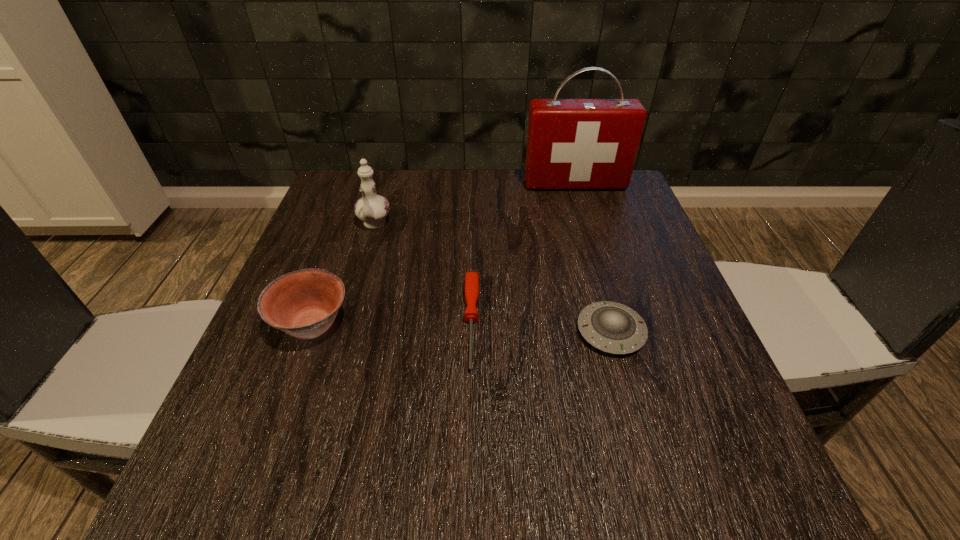
This screenshot has height=540, width=960. Identify the location of the tallest object. (572, 144).

Find the location of a particular element. the first-aid kit is located at coordinates (572, 144).

The width and height of the screenshot is (960, 540). What are the coordinates of `the fourth nearest object` in the screenshot? It's located at (372, 209).

This screenshot has width=960, height=540. In order to click on the second tallest object in this screenshot , I will do `click(372, 209)`.

This screenshot has height=540, width=960. What are the coordinates of `the third shortest object` in the screenshot? It's located at (304, 304).

Find the location of a particular element. saucer is located at coordinates (611, 327).

Identify the location of the third object from left to right. (471, 278).

Locate an element on the screen. This screenshot has height=540, width=960. screwdriver is located at coordinates [471, 278].

Where is `free spot located 0.180m on the front face of the tallest object`? Image resolution: width=960 pixels, height=540 pixels. free spot located 0.180m on the front face of the tallest object is located at coordinates click(x=590, y=234).

The image size is (960, 540). In order to click on blank space located 0.390m at the spout of the fourth nearest object in this screenshot , I will do `click(327, 386)`.